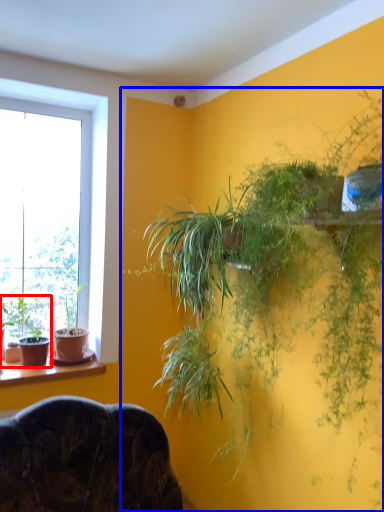
Question: Which object appears farthest to the camera in this image, houseplant (highlighted by a red box) or houseplant (highlighted by a blue box)?

Choices:
 (A) houseplant
 (B) houseplant

Answer: (A)